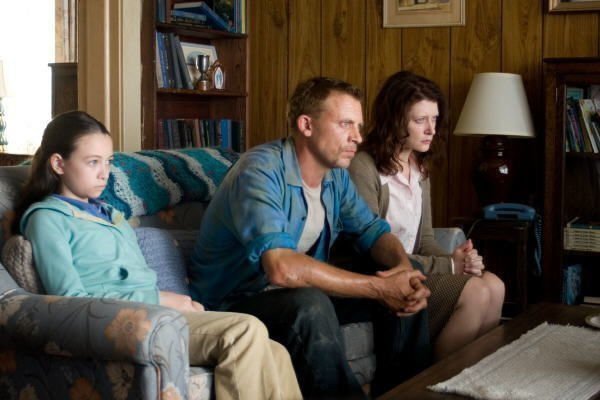
The width and height of the screenshot is (600, 400). In order to click on shelves in this screenshot , I will do (564, 212), (182, 46).